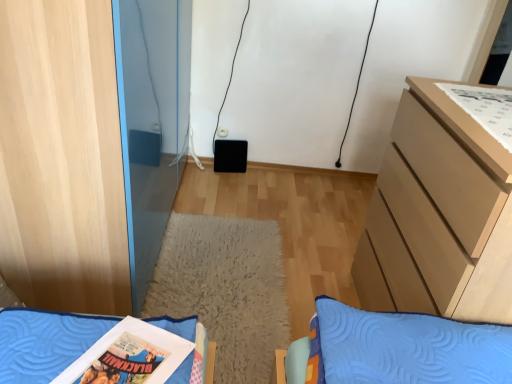
Question: Can you confirm if light wood cabinet at left is shorter than white paper comic book at upper right?

Choices:
 (A) no
 (B) yes

Answer: (A)

Question: Is light wood cabinet at left taller than white paper comic book at upper right?

Choices:
 (A) yes
 (B) no

Answer: (A)

Question: Does light wood cabinet at left appear on the left side of white paper comic book at upper right?

Choices:
 (A) no
 (B) yes

Answer: (B)

Question: Is light wood cabinet at left positioned before white paper comic book at upper right?

Choices:
 (A) no
 (B) yes

Answer: (B)

Question: Is white paper comic book at upper right surrounded by light wood cabinet at left?

Choices:
 (A) yes
 (B) no

Answer: (B)

Question: From the image's perspective, relative to light wood cabinet at left, is blue quilted pillow at lower left above or below?

Choices:
 (A) below
 (B) above

Answer: (A)

Question: Visually, is blue quilted pillow at lower left positioned to the left or to the right of light wood cabinet at left?

Choices:
 (A) right
 (B) left

Answer: (A)

Question: Is blue quilted pillow at lower left situated inside light wood cabinet at left or outside?

Choices:
 (A) inside
 (B) outside

Answer: (B)

Question: From a real-world perspective, is blue quilted pillow at lower left physically located above or below light wood cabinet at left?

Choices:
 (A) above
 (B) below

Answer: (B)

Question: Visually, is blue quilted pillow at lower left positioned to the left or to the right of white paper comic book at upper right?

Choices:
 (A) left
 (B) right

Answer: (A)

Question: Looking at their shapes, would you say blue quilted pillow at lower left is wider or thinner than white paper comic book at upper right?

Choices:
 (A) wide
 (B) thin

Answer: (B)

Question: From the image's perspective, is blue quilted pillow at lower left above or below white paper comic book at upper right?

Choices:
 (A) above
 (B) below

Answer: (B)

Question: Is point (30, 322) positioned closer to the camera than point (472, 105)?

Choices:
 (A) farther
 (B) closer

Answer: (B)

Question: Looking at their shapes, would you say light brown wooden chest of drawers at right is wider or thinner than white paper comic book at upper right?

Choices:
 (A) thin
 (B) wide

Answer: (B)

Question: Based on their positions, is light brown wooden chest of drawers at right located to the left or right of white paper comic book at upper right?

Choices:
 (A) right
 (B) left

Answer: (B)